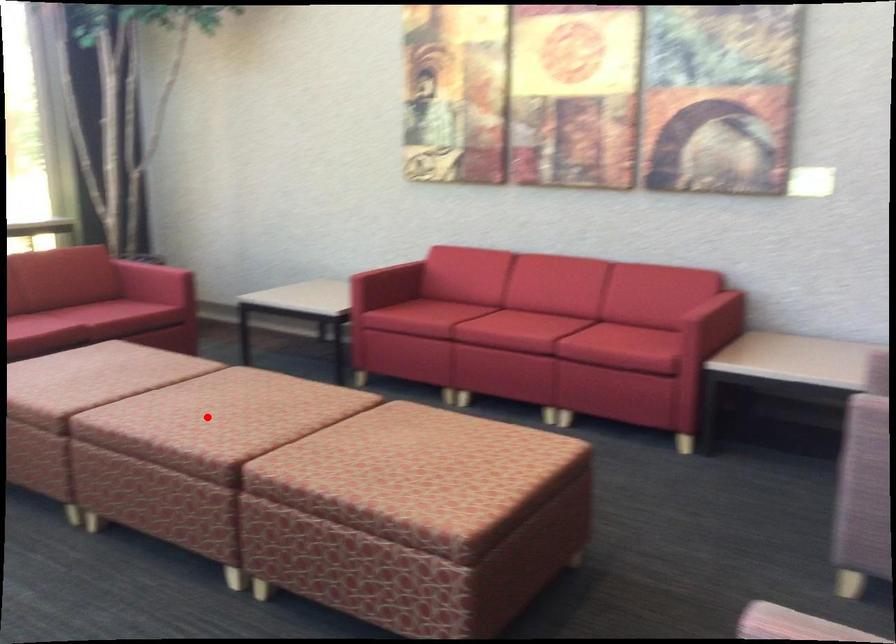
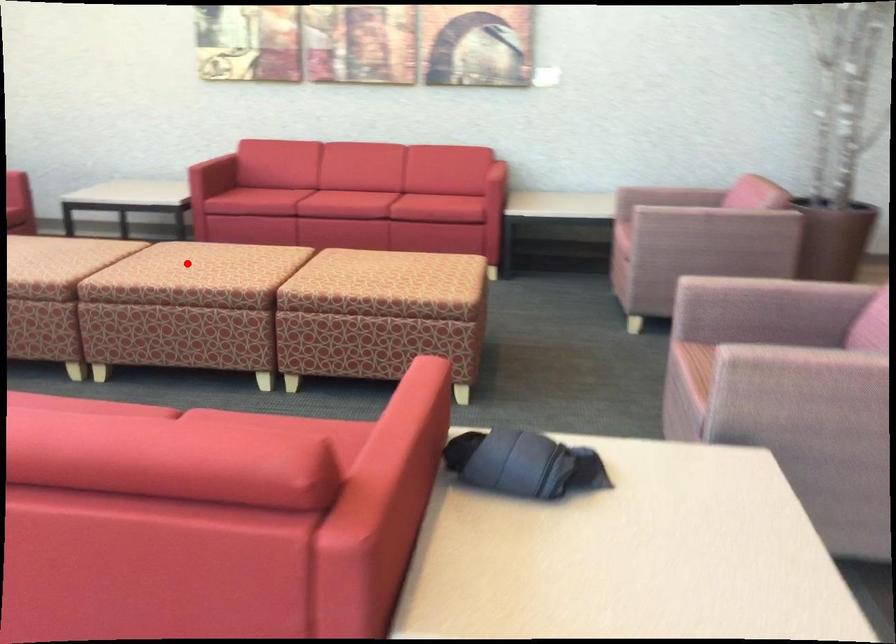
I am providing you with two images of the same scene from different viewpoints. A red point is marked on the first image and another point is marked on the second image. Are the points marked in image1 and image2 representing the same 3D position?

Yes